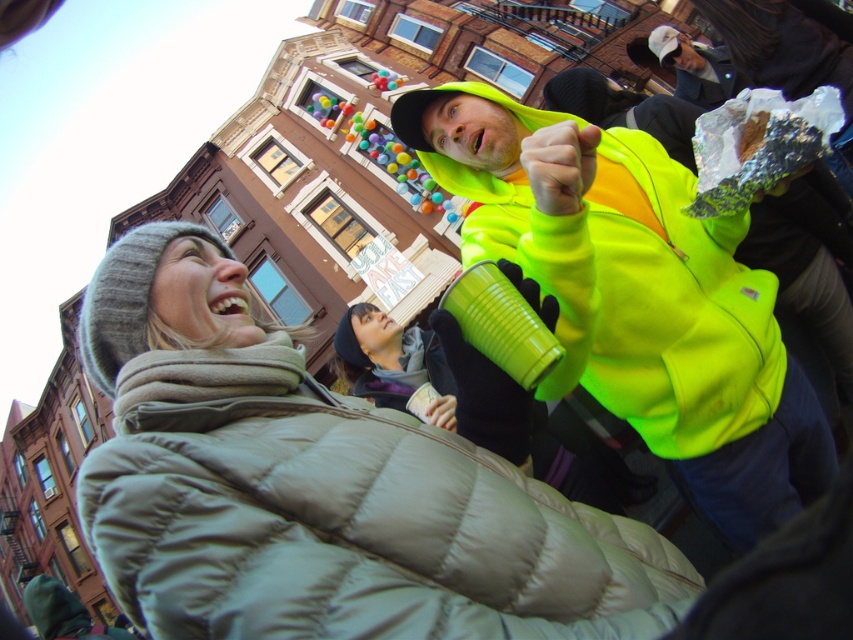
Does matte gray puffer jacket at lower left appear on the right side of white glossy teeth at center?

Yes, matte gray puffer jacket at lower left is to the right of white glossy teeth at center.

In order to click on matte gray puffer jacket at lower left in this screenshot , I will do `click(344, 518)`.

Locate an element on the screen. The image size is (853, 640). matte gray puffer jacket at lower left is located at coordinates (344, 518).

Image resolution: width=853 pixels, height=640 pixels. In order to click on matte gray puffer jacket at lower left in this screenshot , I will do `click(344, 518)`.

Does point (630, 422) come behind point (712, 72)?

No, (630, 422) is in front of (712, 72).

Where is `neon yellow fleece at center`? Image resolution: width=853 pixels, height=640 pixels. neon yellow fleece at center is located at coordinates (624, 276).

Is point (677, 436) farther from viewer compared to point (672, 51)?

No.

Locate an element on the screen. This screenshot has width=853, height=640. neon yellow fleece at center is located at coordinates (624, 276).

Who is shorter, white cotton cap at upper right or white glossy teeth at center?

Standing shorter between the two is white glossy teeth at center.

Is point (656, 60) closer to camera compared to point (241, 292)?

That is False.

At what (x,y) coordinates should I click in order to perform the action: click on white cotton cap at upper right. Please return your answer as a coordinate pair (x, y). This screenshot has width=853, height=640. Looking at the image, I should click on (691, 67).